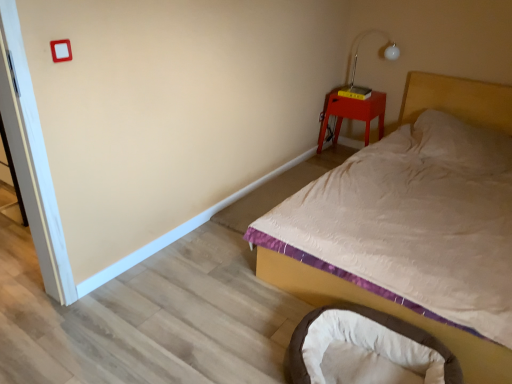
Question: Is matte red wooden nightstand at upper right positioned behind white quilted fabric bed at upper right?

Choices:
 (A) no
 (B) yes

Answer: (B)

Question: Is matte red wooden nightstand at upper right next to white quilted fabric bed at upper right and touching it?

Choices:
 (A) no
 (B) yes

Answer: (A)

Question: Does matte red wooden nightstand at upper right come in front of white quilted fabric bed at upper right?

Choices:
 (A) yes
 (B) no

Answer: (B)

Question: Could white quilted fabric bed at upper right be considered to be inside matte red wooden nightstand at upper right?

Choices:
 (A) yes
 (B) no

Answer: (B)

Question: Are matte red wooden nightstand at upper right and white quilted fabric bed at upper right far apart?

Choices:
 (A) no
 (B) yes

Answer: (B)

Question: Can we say matte red wooden nightstand at upper right lies outside white quilted fabric bed at upper right?

Choices:
 (A) no
 (B) yes

Answer: (B)

Question: Considering the relative positions of white quilted fabric bed at upper right and metallic silver table lamp at upper right in the image provided, is white quilted fabric bed at upper right in front of metallic silver table lamp at upper right?

Choices:
 (A) no
 (B) yes

Answer: (B)

Question: Could you tell me if white quilted fabric bed at upper right is turned towards metallic silver table lamp at upper right?

Choices:
 (A) yes
 (B) no

Answer: (B)

Question: Is white quilted fabric bed at upper right taller than metallic silver table lamp at upper right?

Choices:
 (A) yes
 (B) no

Answer: (A)

Question: From a real-world perspective, is white quilted fabric bed at upper right physically below metallic silver table lamp at upper right?

Choices:
 (A) no
 (B) yes

Answer: (B)

Question: Is white quilted fabric bed at upper right oriented away from metallic silver table lamp at upper right?

Choices:
 (A) yes
 (B) no

Answer: (B)

Question: From the image's perspective, is white quilted fabric bed at upper right beneath metallic silver table lamp at upper right?

Choices:
 (A) no
 (B) yes

Answer: (B)

Question: Considering the relative sizes of metallic silver table lamp at upper right and matte red wooden nightstand at upper right in the image provided, is metallic silver table lamp at upper right thinner than matte red wooden nightstand at upper right?

Choices:
 (A) no
 (B) yes

Answer: (B)